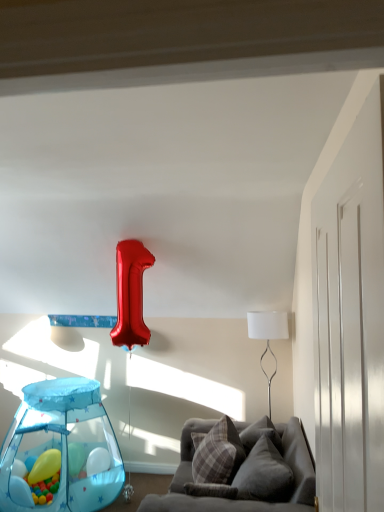
Where is `translucent blue balloon at lower left, the second balloon positioned from the back`? translucent blue balloon at lower left, the second balloon positioned from the back is located at coordinates (20, 490).

The image size is (384, 512). What do you see at coordinates (61, 450) in the screenshot?
I see `translucent plastic play tent at lower left` at bounding box center [61, 450].

Where is `translucent plastic play tent at lower left`? translucent plastic play tent at lower left is located at coordinates (61, 450).

This screenshot has width=384, height=512. Describe the element at coordinates (45, 466) in the screenshot. I see `rubber yellow ball at lower left, the 2th balloon when ordered from front to back` at that location.

Locate an element on the screen. velvet gray couch at lower right is located at coordinates (212, 505).

Can you confirm if velvet gray couch at lower right is shorter than translucent blue balloon at lower left, the second balloon positioned from the back?

In fact, velvet gray couch at lower right may be taller than translucent blue balloon at lower left, the second balloon positioned from the back.

From the image's perspective, who appears lower, velvet gray couch at lower right or translucent blue balloon at lower left, the second balloon positioned from the back?

translucent blue balloon at lower left, the second balloon positioned from the back.

Considering the relative sizes of velvet gray couch at lower right and translucent blue balloon at lower left, which is the first balloon from front to back, in the image provided, is velvet gray couch at lower right wider than translucent blue balloon at lower left, which is the first balloon from front to back,?

Yes.

What are the coordinates of `the 1st balloon counting from the left of the plaid fabric pillow at center, placed as the 1th pillow when sorted from back to front` in the screenshot? It's located at (45, 466).

Does plaid fabric pillow at center, arranged as the second pillow when viewed from the front, have a smaller size compared to rubber yellow ball at lower left, the 2th balloon when ordered from front to back?

No, plaid fabric pillow at center, arranged as the second pillow when viewed from the front, is not smaller than rubber yellow ball at lower left, the 2th balloon when ordered from front to back.

Are plaid fabric pillow at center, placed as the 1th pillow when sorted from back to front, and rubber yellow ball at lower left, positioned as the 1th balloon in back-to-front order, making contact?

They are not placed beside each other.

How much distance is there between plaid fabric pillow at center, arranged as the second pillow when viewed from the front, and rubber yellow ball at lower left, positioned as the 1th balloon in back-to-front order?

plaid fabric pillow at center, arranged as the second pillow when viewed from the front, is 1.25 meters away from rubber yellow ball at lower left, positioned as the 1th balloon in back-to-front order.

Starting from the translucent blue balloon at lower left, which is the first balloon from front to back, which pillow is the 2nd one to the right? Please provide its 2D coordinates.

[(264, 474)]

In the image, is translucent blue balloon at lower left, the second balloon positioned from the back, positioned in front of or behind velvet gray pillow at lower right, the 2th pillow viewed from the back?

In the image, translucent blue balloon at lower left, the second balloon positioned from the back, appears behind velvet gray pillow at lower right, the 2th pillow viewed from the back.

From a real-world perspective, which is physically below, translucent blue balloon at lower left, which is the first balloon from front to back, or velvet gray pillow at lower right, the 2th pillow viewed from the back?

translucent blue balloon at lower left, which is the first balloon from front to back.

Is velvet gray pillow at lower right, which ranks as the 1th pillow in front-to-back order, facing away from plaid fabric pillow at center, arranged as the second pillow when viewed from the front?

velvet gray pillow at lower right, which ranks as the 1th pillow in front-to-back order, is not turned away from plaid fabric pillow at center, arranged as the second pillow when viewed from the front.

Is plaid fabric pillow at center, arranged as the second pillow when viewed from the front, a part of velvet gray pillow at lower right, the 2th pillow viewed from the back?

No, plaid fabric pillow at center, arranged as the second pillow when viewed from the front, is not surrounded by velvet gray pillow at lower right, the 2th pillow viewed from the back.

Are velvet gray pillow at lower right, which ranks as the 1th pillow in front-to-back order, and plaid fabric pillow at center, arranged as the second pillow when viewed from the front, making contact?

No.

Is velvet gray pillow at lower right, the 2th pillow viewed from the back, to the left or to the right of plaid fabric pillow at center, arranged as the second pillow when viewed from the front, in the image?

Based on their positions, velvet gray pillow at lower right, the 2th pillow viewed from the back, is located to the right of plaid fabric pillow at center, arranged as the second pillow when viewed from the front.

Is plaid fabric pillow at center, arranged as the second pillow when viewed from the front, facing away from white fabric lampshade at upper right?

plaid fabric pillow at center, arranged as the second pillow when viewed from the front, is not turned away from white fabric lampshade at upper right.

Which object is more forward, plaid fabric pillow at center, arranged as the second pillow when viewed from the front, or white fabric lampshade at upper right?

plaid fabric pillow at center, arranged as the second pillow when viewed from the front, is in front.

In the scene shown: Is plaid fabric pillow at center, placed as the 1th pillow when sorted from back to front, to the left of white fabric lampshade at upper right from the viewer's perspective?

Correct, you'll find plaid fabric pillow at center, placed as the 1th pillow when sorted from back to front, to the left of white fabric lampshade at upper right.

Based on the photo, is rubber yellow ball at lower left, the 2th balloon when ordered from front to back, located within velvet gray couch at lower right?

No, rubber yellow ball at lower left, the 2th balloon when ordered from front to back, is not a part of velvet gray couch at lower right.

How different are the orientations of velvet gray couch at lower right and rubber yellow ball at lower left, positioned as the 1th balloon in back-to-front order, in degrees?

There is a 93.8-degree angle between the facing directions of velvet gray couch at lower right and rubber yellow ball at lower left, positioned as the 1th balloon in back-to-front order.

Could you measure the distance between velvet gray couch at lower right and rubber yellow ball at lower left, the 2th balloon when ordered from front to back?

They are 1.35 meters apart.

Does velvet gray couch at lower right appear on the left side of rubber yellow ball at lower left, the 2th balloon when ordered from front to back?

No, velvet gray couch at lower right is not to the left of rubber yellow ball at lower left, the 2th balloon when ordered from front to back.

Is white fabric lampshade at upper right bigger or smaller than plaid fabric pillow at center, arranged as the second pillow when viewed from the front?

Clearly, white fabric lampshade at upper right is larger in size than plaid fabric pillow at center, arranged as the second pillow when viewed from the front.

Is white fabric lampshade at upper right placed right next to plaid fabric pillow at center, arranged as the second pillow when viewed from the front?

No, white fabric lampshade at upper right is not in contact with plaid fabric pillow at center, arranged as the second pillow when viewed from the front.

Considering the positions of points (268, 405) and (226, 445), is point (268, 405) farther from camera compared to point (226, 445)?

That is True.

Find the location of a particular element. The width and height of the screenshot is (384, 512). studio couch lying above the translucent blue balloon at lower left, which is the first balloon from front to back (from the image's perspective) is located at coordinates (212, 505).

This screenshot has width=384, height=512. I want to click on the 1st pillow to the right when counting from the rubber yellow ball at lower left, positioned as the 1th balloon in back-to-front order, so click(x=218, y=454).

Based on their spatial positions, is rubber yellow ball at lower left, the 2th balloon when ordered from front to back, or plaid fabric pillow at center, placed as the 1th pillow when sorted from back to front, closer to white fabric lampshade at upper right?

Among the two, plaid fabric pillow at center, placed as the 1th pillow when sorted from back to front, is located nearer to white fabric lampshade at upper right.

Looking at the image, which one is located closer to rubber yellow ball at lower left, positioned as the 1th balloon in back-to-front order, velvet gray couch at lower right or translucent blue balloon at lower left, the second balloon positioned from the back?

translucent blue balloon at lower left, the second balloon positioned from the back.

When comparing their distances from translucent plastic play tent at lower left, does white fabric lampshade at upper right or translucent blue balloon at lower left, the second balloon positioned from the back, seem closer?

translucent blue balloon at lower left, the second balloon positioned from the back.

From the picture: From the image, which object appears to be nearer to velvet gray pillow at lower right, the 2th pillow viewed from the back, translucent plastic play tent at lower left or plaid fabric pillow at center, placed as the 1th pillow when sorted from back to front?

Based on the image, plaid fabric pillow at center, placed as the 1th pillow when sorted from back to front, appears to be nearer to velvet gray pillow at lower right, the 2th pillow viewed from the back.

Based on their spatial positions, is velvet gray couch at lower right or plaid fabric pillow at center, arranged as the second pillow when viewed from the front, further from translucent blue balloon at lower left, which is the first balloon from front to back?

Based on the image, velvet gray couch at lower right appears to be further to translucent blue balloon at lower left, which is the first balloon from front to back.

Which object lies further to the anchor point translucent blue balloon at lower left, which is the first balloon from front to back, translucent plastic play tent at lower left or rubber yellow ball at lower left, positioned as the 1th balloon in back-to-front order?

The object further to translucent blue balloon at lower left, which is the first balloon from front to back, is translucent plastic play tent at lower left.

Based on their spatial positions, is rubber yellow ball at lower left, the 2th balloon when ordered from front to back, or translucent plastic play tent at lower left further from velvet gray pillow at lower right, the 2th pillow viewed from the back?

Among the two, translucent plastic play tent at lower left is located further to velvet gray pillow at lower right, the 2th pillow viewed from the back.

Considering their positions, is plaid fabric pillow at center, arranged as the second pillow when viewed from the front, positioned further to translucent blue balloon at lower left, the second balloon positioned from the back, than velvet gray couch at lower right?

The object further to translucent blue balloon at lower left, the second balloon positioned from the back, is velvet gray couch at lower right.

Find the location of a particular element. balloon between translucent blue balloon at lower left, the second balloon positioned from the back, and white fabric lampshade at upper right, in the horizontal direction is located at coordinates (45, 466).

Find the location of `balloon between translucent plastic play tent at lower left and rubber yellow ball at lower left, positioned as the 1th balloon in back-to-front order, in the front-back direction`. balloon between translucent plastic play tent at lower left and rubber yellow ball at lower left, positioned as the 1th balloon in back-to-front order, in the front-back direction is located at coordinates (20, 490).

Where is `studio couch situated between translucent blue balloon at lower left, which is the first balloon from front to back, and white fabric lampshade at upper right from left to right`? studio couch situated between translucent blue balloon at lower left, which is the first balloon from front to back, and white fabric lampshade at upper right from left to right is located at coordinates (212, 505).

This screenshot has width=384, height=512. I want to click on studio couch situated between translucent blue balloon at lower left, the second balloon positioned from the back, and velvet gray pillow at lower right, the 2th pillow viewed from the back, from left to right, so click(x=212, y=505).